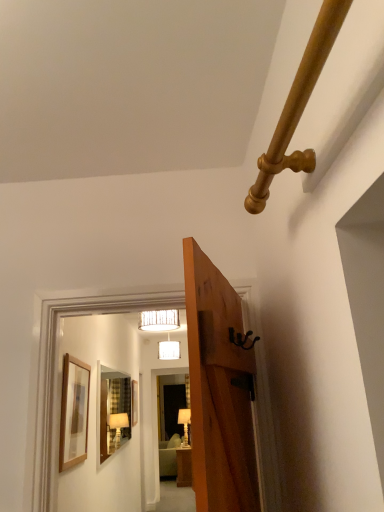
Question: Can you confirm if matte white lampshade at upper center, marked as the 1th lamp in a front-to-back arrangement, is taller than white fabric lampshade at upper center, the 2th lamp in the bottom-to-top sequence?

Choices:
 (A) no
 (B) yes

Answer: (A)

Question: Is matte white lampshade at upper center, which is counted as the third lamp, starting from the bottom, touching white fabric lampshade at upper center, the 2th lamp in the bottom-to-top sequence?

Choices:
 (A) yes
 (B) no

Answer: (B)

Question: Considering the relative sizes of matte white lampshade at upper center, the third lamp in the back-to-front sequence, and white fabric lampshade at upper center, which ranks as the second lamp in front-to-back order, in the image provided, is matte white lampshade at upper center, the third lamp in the back-to-front sequence, smaller than white fabric lampshade at upper center, which ranks as the second lamp in front-to-back order,?

Choices:
 (A) no
 (B) yes

Answer: (B)

Question: Can you confirm if matte white lampshade at upper center, which appears as the first lamp when viewed from the top, is shorter than white fabric lampshade at upper center, the second lamp from the back?

Choices:
 (A) yes
 (B) no

Answer: (A)

Question: Does matte white lampshade at upper center, which appears as the first lamp when viewed from the top, come in front of white fabric lampshade at upper center, the second lamp from the top?

Choices:
 (A) no
 (B) yes

Answer: (B)

Question: In terms of height, does white fabric lampshade at upper center, the 2th lamp in the bottom-to-top sequence, look taller or shorter compared to white glossy lamp at center, which ranks as the first lamp in back-to-front order?

Choices:
 (A) short
 (B) tall

Answer: (A)

Question: From a real-world perspective, is white fabric lampshade at upper center, the second lamp from the top, physically located above or below white glossy lamp at center, which ranks as the first lamp in back-to-front order?

Choices:
 (A) above
 (B) below

Answer: (A)

Question: Is white fabric lampshade at upper center, the 2th lamp in the bottom-to-top sequence, wider or thinner than white glossy lamp at center, arranged as the 1th lamp when ordered from the bottom?

Choices:
 (A) thin
 (B) wide

Answer: (B)

Question: Would you say white fabric lampshade at upper center, the 2th lamp in the bottom-to-top sequence, is inside or outside white glossy lamp at center, arranged as the 1th lamp when ordered from the bottom?

Choices:
 (A) inside
 (B) outside

Answer: (B)

Question: Is matte white lampshade at upper center, which is counted as the third lamp, starting from the bottom, spatially inside clear glass mirror at center, or outside of it?

Choices:
 (A) outside
 (B) inside

Answer: (A)

Question: Is matte white lampshade at upper center, the third lamp in the back-to-front sequence, wider or thinner than clear glass mirror at center?

Choices:
 (A) thin
 (B) wide

Answer: (B)

Question: In the image, is matte white lampshade at upper center, which appears as the first lamp when viewed from the top, positioned in front of or behind clear glass mirror at center?

Choices:
 (A) front
 (B) behind

Answer: (B)

Question: Considering the positions of matte white lampshade at upper center, which appears as the first lamp when viewed from the top, and clear glass mirror at center in the image, is matte white lampshade at upper center, which appears as the first lamp when viewed from the top, taller or shorter than clear glass mirror at center?

Choices:
 (A) short
 (B) tall

Answer: (A)

Question: Is point (210, 399) positioned closer to the camera than point (134, 392)?

Choices:
 (A) closer
 (B) farther

Answer: (A)

Question: Is wooden door at center taller or shorter than wooden picture frame at center, the 1th picture frame when ordered from left to right?

Choices:
 (A) short
 (B) tall

Answer: (B)